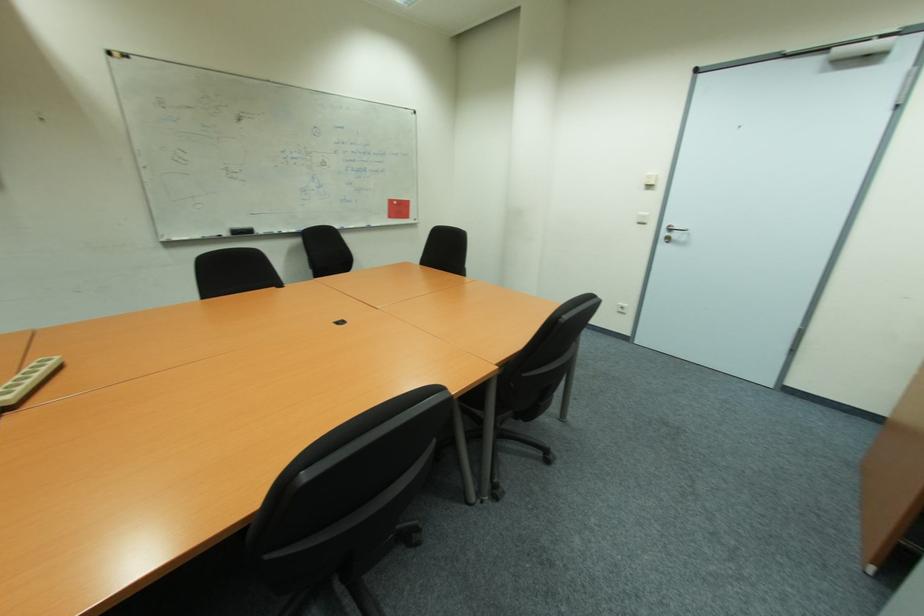
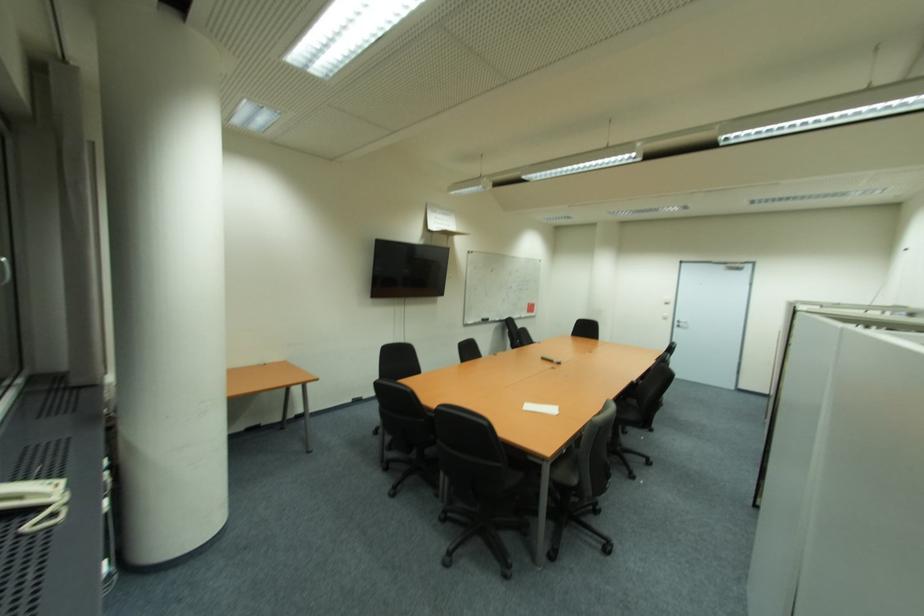
Find the pixel in the second image that matches (677,236) in the first image.

(686, 325)